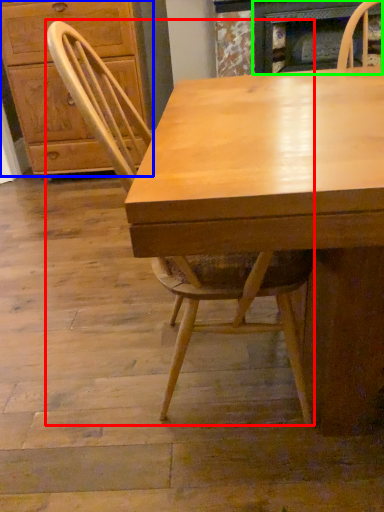
Question: Which is farther away from chair (highlighted by a red box)? cabinetry (highlighted by a blue box) or fireplace (highlighted by a green box)?

Choices:
 (A) cabinetry
 (B) fireplace

Answer: (B)